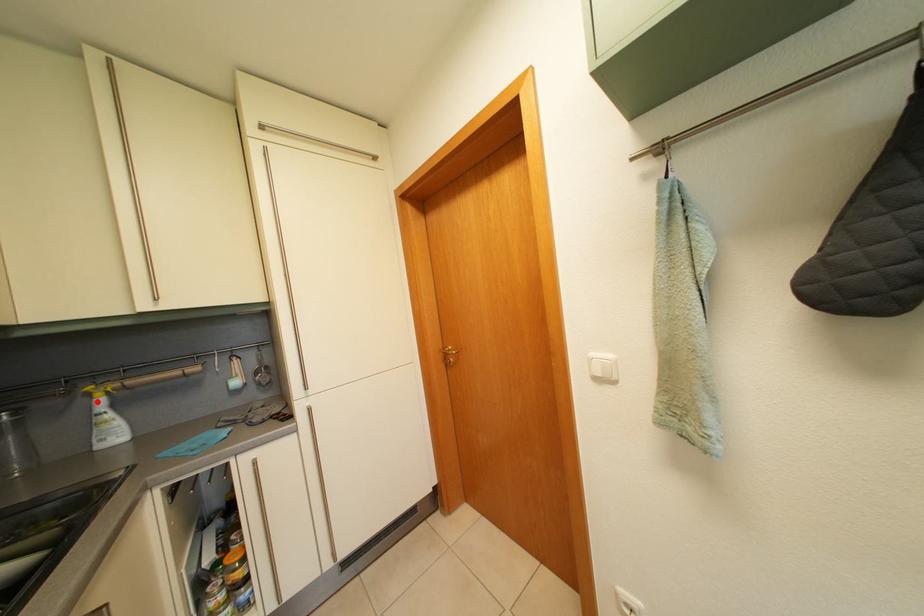
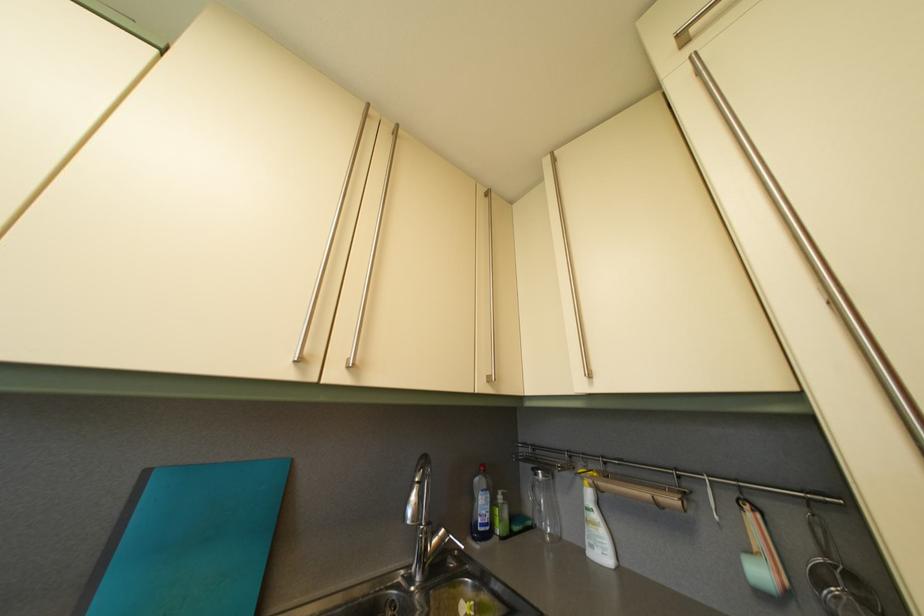
The point at the highlighted location is marked in the first image. Where is the corresponding point in the second image?

(590, 485)